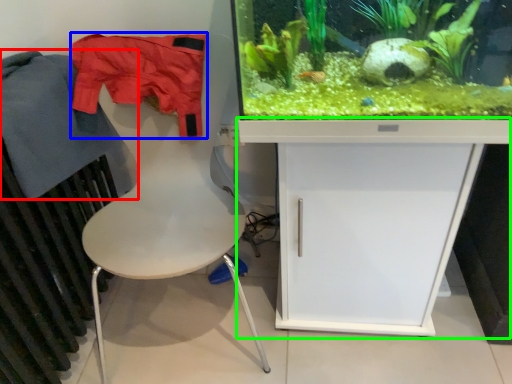
Question: Considering the real-world distances, which object is closest to clothing (highlighted by a red box)? clothing (highlighted by a blue box) or computer desk (highlighted by a green box).

Choices:
 (A) clothing
 (B) computer desk

Answer: (A)